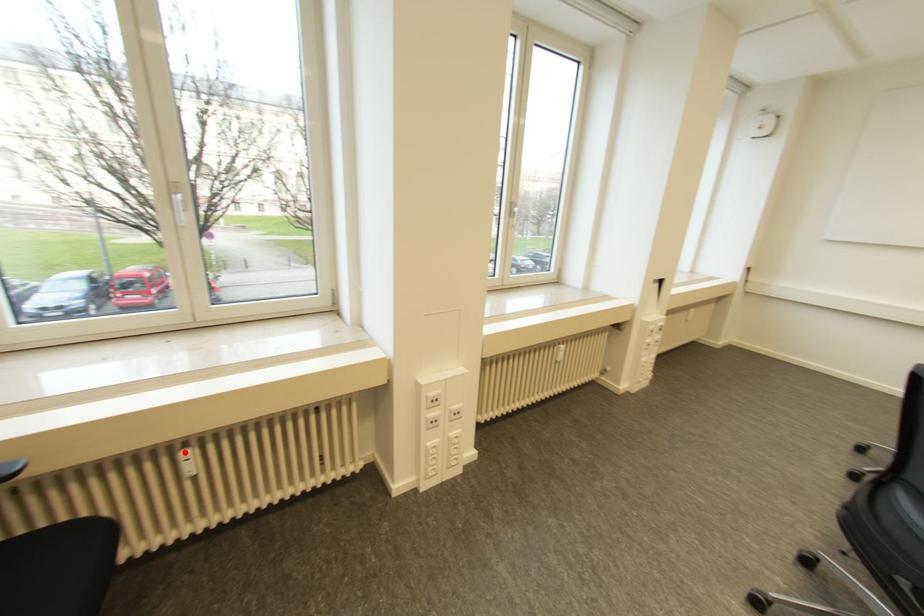
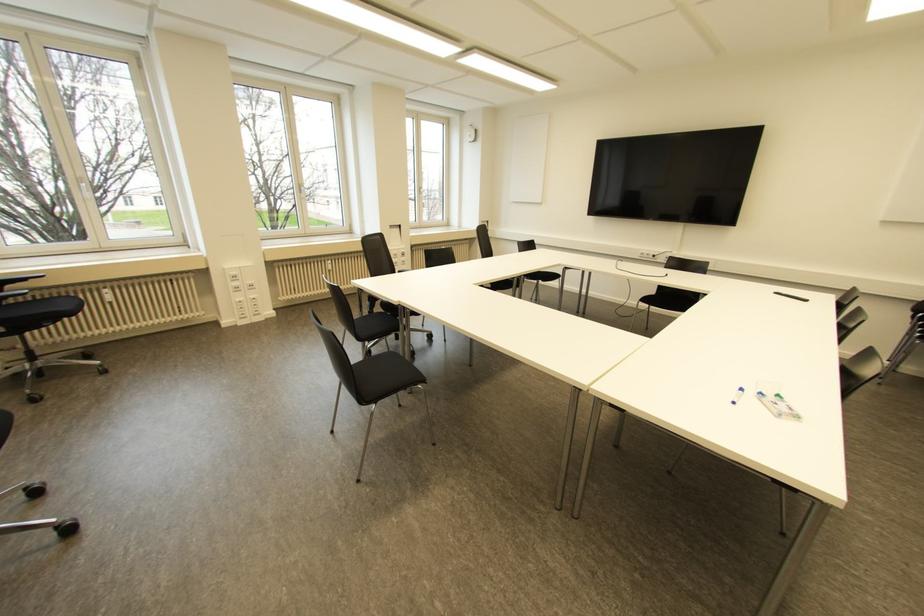
Where in the second image is the point corresponding to the highlighted location from the first image?

(104, 290)